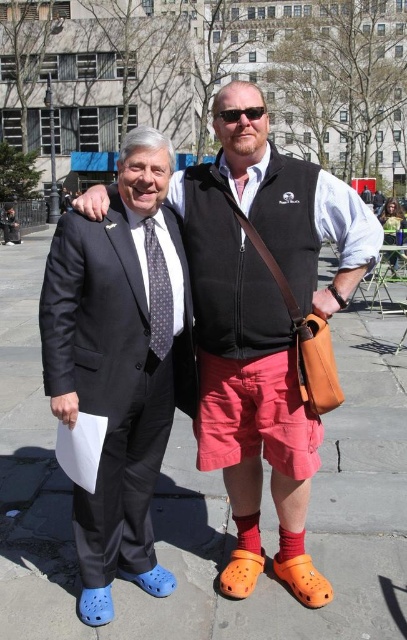
Question: Can you confirm if gray concrete pavement at center is wider than dark gray dotted tie at center?

Choices:
 (A) no
 (B) yes

Answer: (B)

Question: Is matte black suit at left thinner than dark gray dotted tie at center?

Choices:
 (A) yes
 (B) no

Answer: (B)

Question: Estimate the real-world distances between objects in this image. Which object is closer to the matte black suit at left?

Choices:
 (A) gray concrete pavement at center
 (B) sunglasses at center
 (C) dark gray dotted tie at center

Answer: (C)

Question: Considering the real-world distances, which object is closest to the sunglasses at center?

Choices:
 (A) gray concrete pavement at center
 (B) dark gray dotted tie at center
 (C) matte black suit at left

Answer: (B)

Question: Considering the real-world distances, which object is closest to the dark gray dotted tie at center?

Choices:
 (A) gray concrete pavement at center
 (B) matte black suit at left

Answer: (B)

Question: Is dark gray dotted tie at center closer to the viewer compared to sunglasses at center?

Choices:
 (A) yes
 (B) no

Answer: (A)